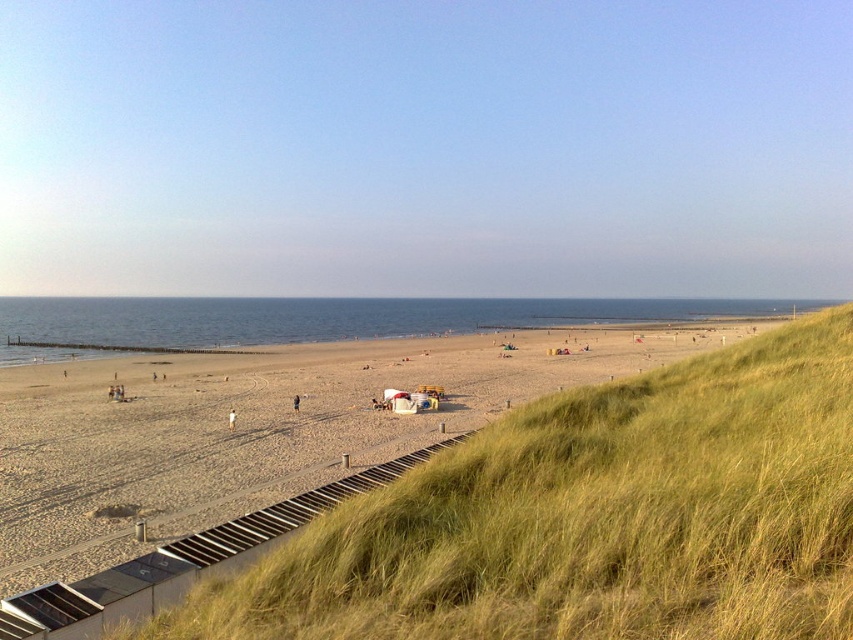
Based on the photo, is light brown sand at center smaller than brown fabric person at center?

Incorrect, light brown sand at center is not smaller in size than brown fabric person at center.

Where is `light brown sand at center`? light brown sand at center is located at coordinates (231, 419).

In the scene shown: Does beige sand beach at center have a smaller size compared to brown fabric person at center?

Actually, beige sand beach at center might be larger than brown fabric person at center.

Is point (157, 468) positioned behind point (293, 408)?

No, (157, 468) is in front of (293, 408).

Is point (579, 326) positioned before point (299, 397)?

No, (579, 326) is behind (299, 397).

The image size is (853, 640). I want to click on beige sand beach at center, so click(x=258, y=428).

Is beige sand beach at center positioned before light brown sand at center?

Yes, beige sand beach at center is closer to the viewer.

Does beige sand beach at center have a lesser width compared to light brown sand at center?

No.

Which is in front, point (131, 483) or point (228, 428)?

Point (131, 483) is in front.

Where is `beige sand beach at center`? beige sand beach at center is located at coordinates (258, 428).